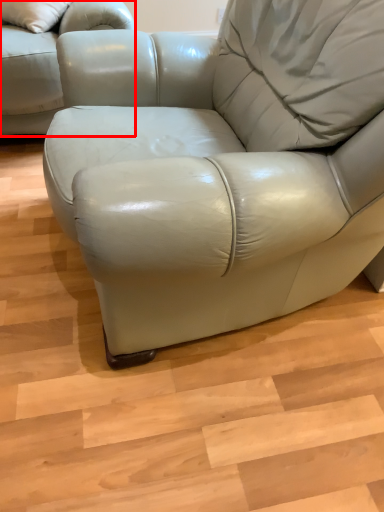
Question: From the image's perspective, what is the correct spatial relationship of studio couch (annotated by the red box) in relation to table?

Choices:
 (A) below
 (B) above

Answer: (B)